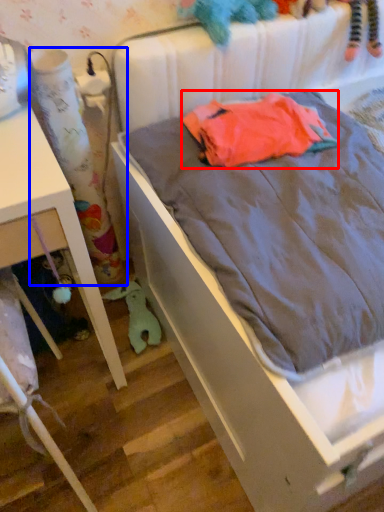
Question: Among these objects, which one is farthest to the camera, baby clothe (highlighted by a red box) or curtain (highlighted by a blue box)?

Choices:
 (A) baby clothe
 (B) curtain

Answer: (A)